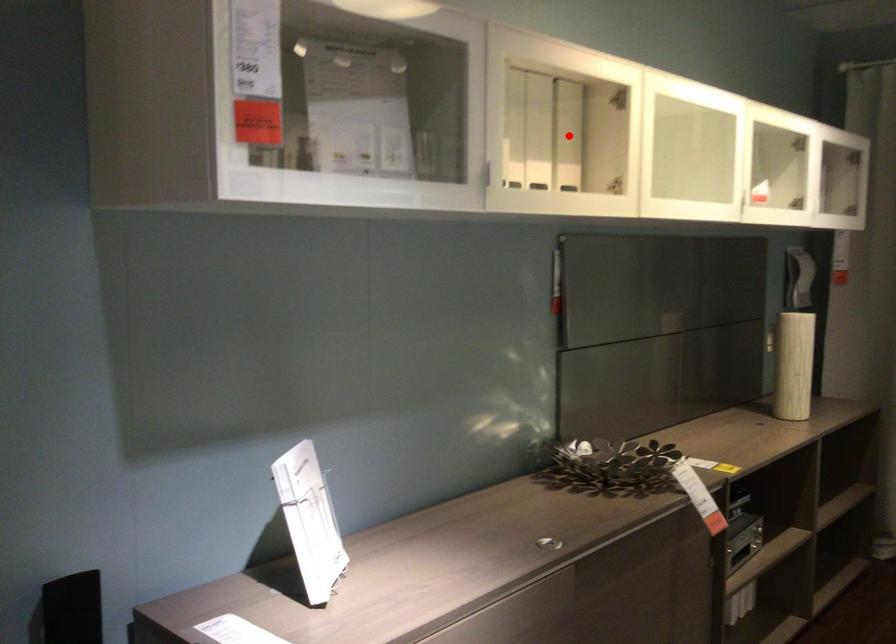
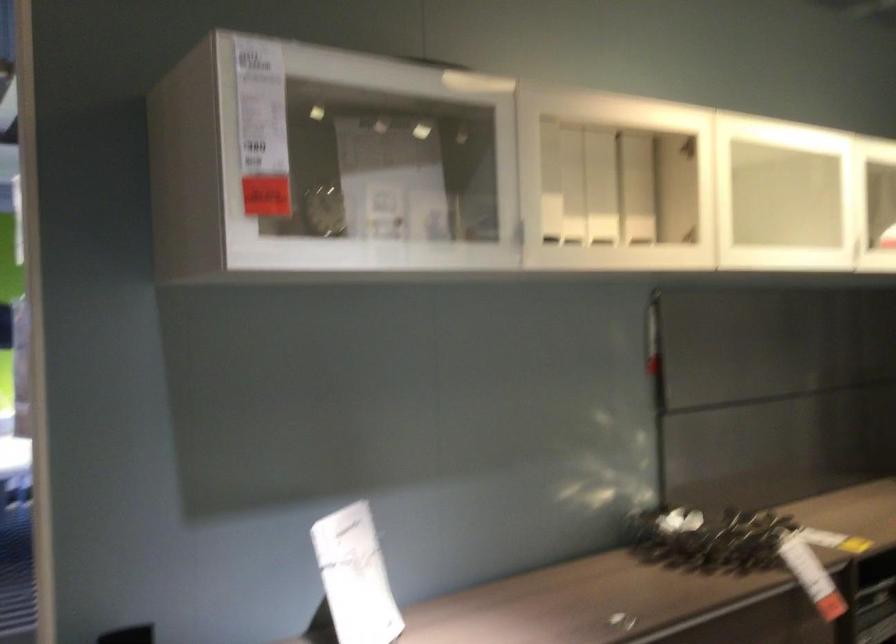
Question: I am providing you with two images of the same scene from different viewpoints. A red point is marked on the first image. At the location where the point appears in image 1, is it still visible in image 2?

Choices:
 (A) Yes
 (B) No

Answer: (A)